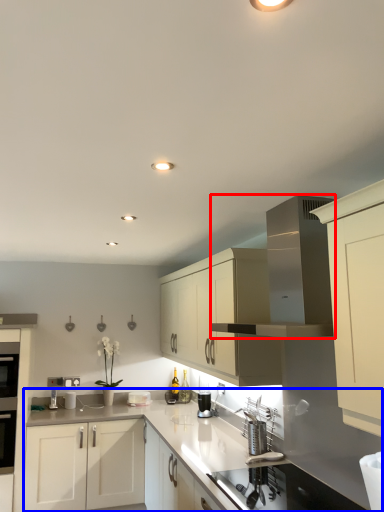
Question: Which point is further to the camera, vent (highlighted by a red box) or countertop (highlighted by a blue box)?

Choices:
 (A) vent
 (B) countertop

Answer: (A)